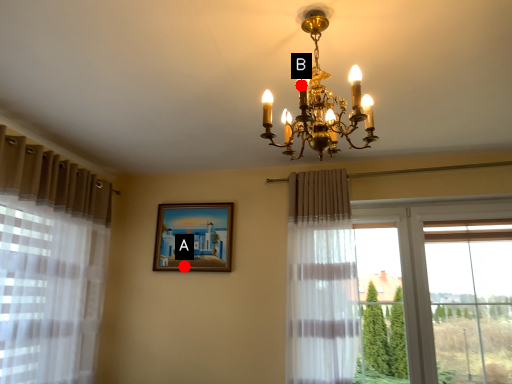
Question: Two points are circled on the image, labeled by A and B beside each circle. Which point is closer to the camera?

Choices:
 (A) A is closer
 (B) B is closer

Answer: (B)